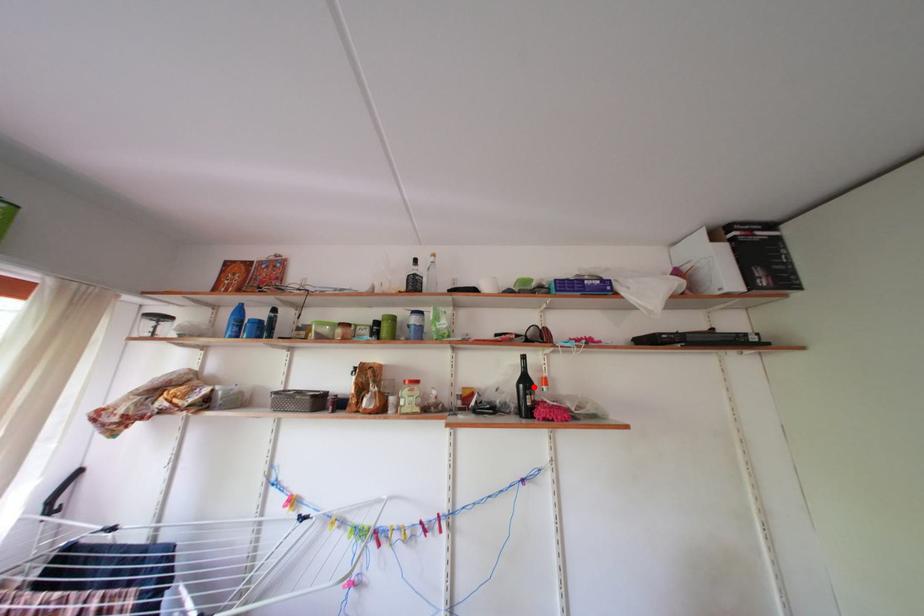
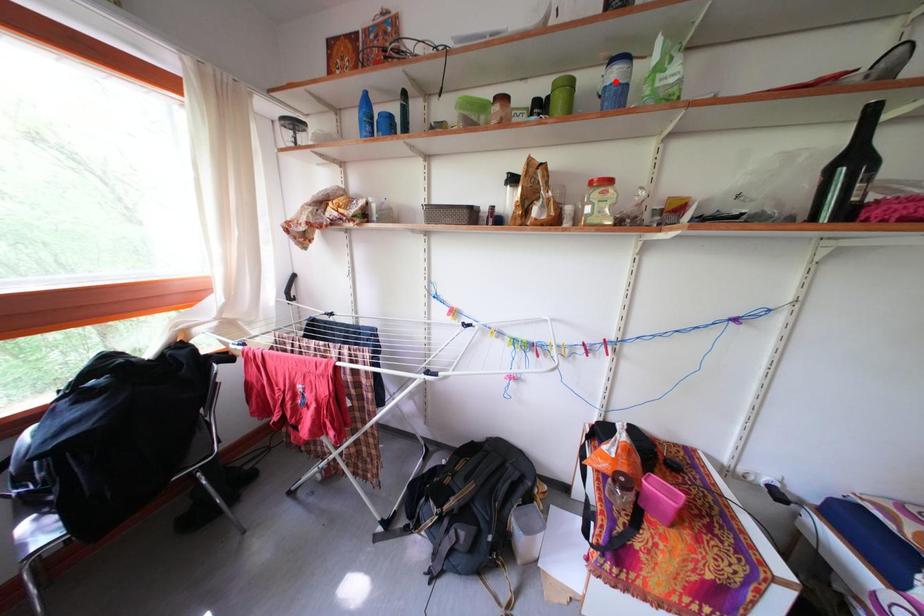
I am providing you with two images of the same scene from different viewpoints. A red point is marked on the first image and another point is marked on the second image. Does the point marked in image1 correspond to the same location as the one in image2?

No